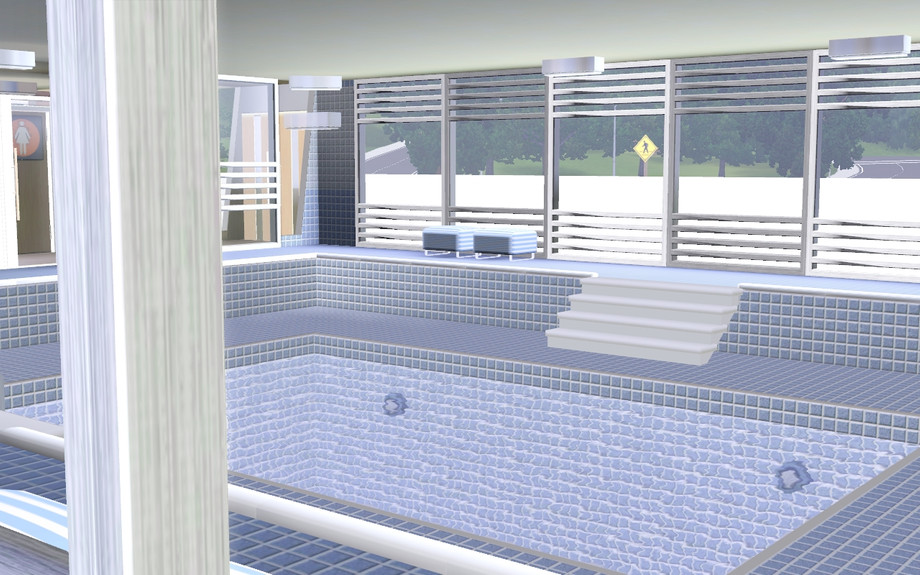
At what (x,y) coordinates should I click in order to perform the action: click on white wall. Please return your answer as a coordinate pair (x, y). Looking at the image, I should click on (600, 189).